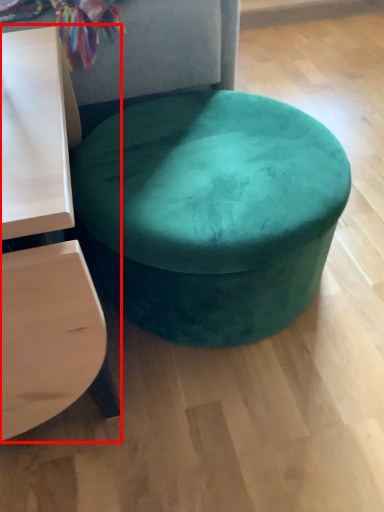
Question: From the image's perspective, where is table (annotated by the red box) located in relation to stool in the image?

Choices:
 (A) above
 (B) below

Answer: (B)